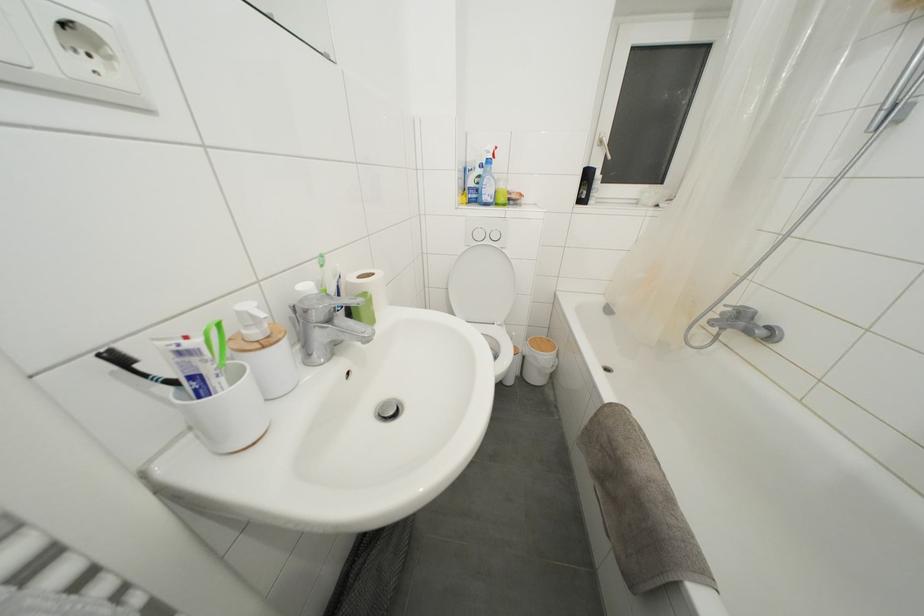
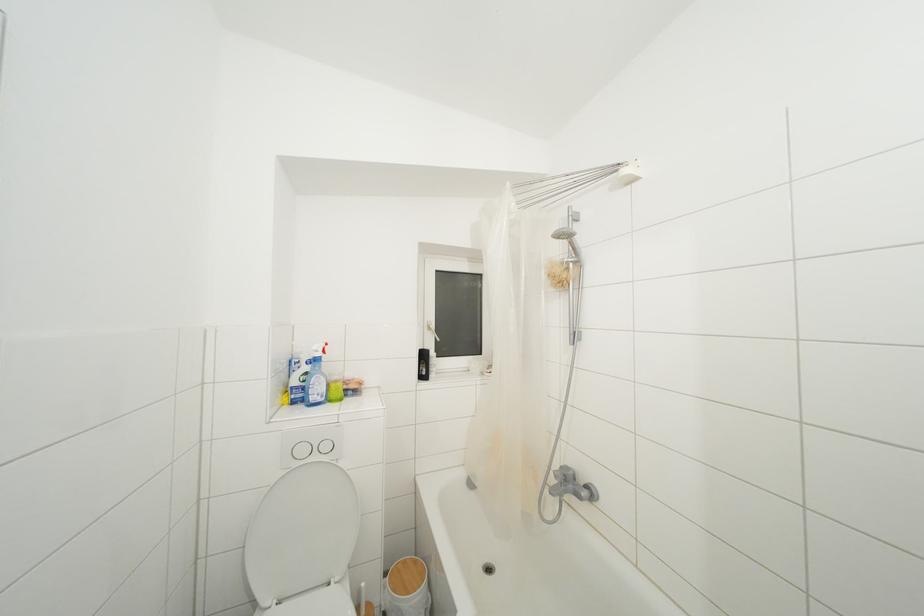
In the second image, find the point that corresponds to the point at 483,240 in the first image.

(307, 456)